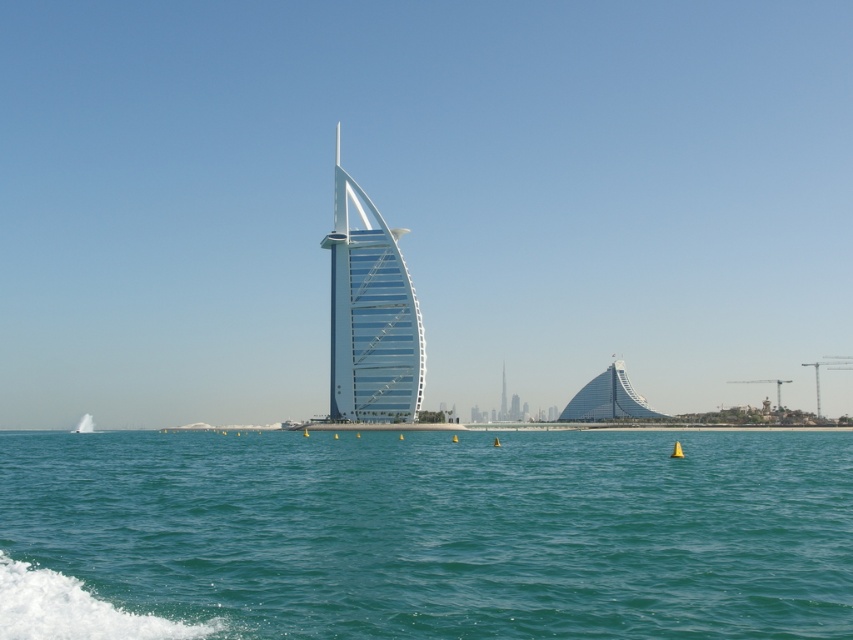
You are a photographer planning to capture the entire view of the Burj Al Arab and Jumeirah Beach Hotel in one shot. Given that your camera frame can only accommodate objects up to the size of the transparent glass sail at center, will the clear blue water at center fit within the frame?

The clear blue water at center is larger in size than the transparent glass sail at center, so it will not fit within the camera frame designed for the sail.

You are a tourist planning to take a boat ride between the clear blue water at center and the transparent glass sail at center. Which area has a wider space for your boat to navigate comfortably?

The clear blue water at center has a greater width than the transparent glass sail at center, so it offers a wider space for the boat to navigate comfortably.

You are a boat captain planning to navigate a 50 meter long cruise ship through the area shown in the image. The ship requires a minimum of 55 meters of clearance between any two obstacles to safely pass. Based on the scene, can you safely navigate between the clear blue water at center and the transparent glass sail at center?

The distance between the clear blue water at center and the transparent glass sail at center is 57.07 meters, which exceeds the required 55 meters of clearance. Therefore, the cruise ship can safely navigate between them.